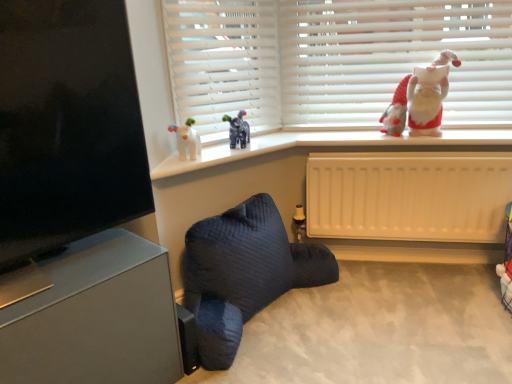
The image size is (512, 384). In order to click on vacant point to the right of dark blue quilted bean bag chair at lower center in this screenshot , I will do `click(388, 319)`.